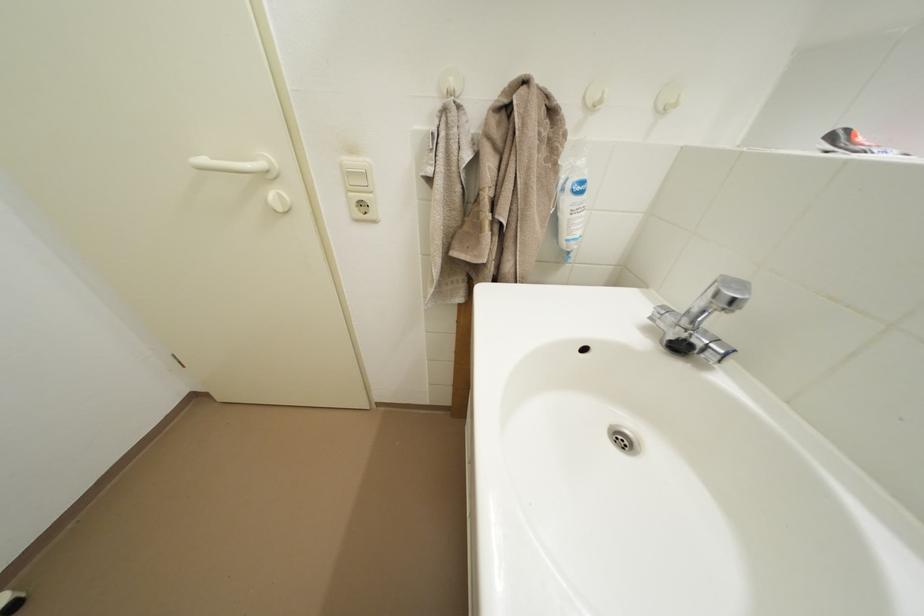
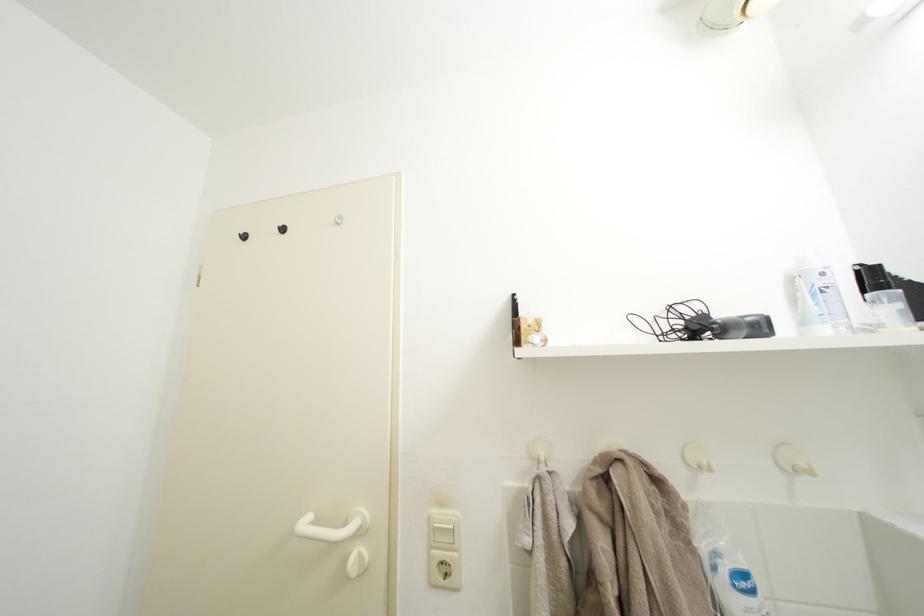
The point at (684, 106) is marked in the first image. Where is the corresponding point in the second image?

(813, 471)